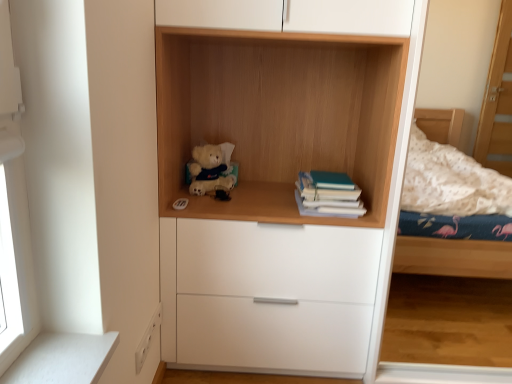
The height and width of the screenshot is (384, 512). Identify the location of vacant space in front of soft plush teddy bear at center. (208, 202).